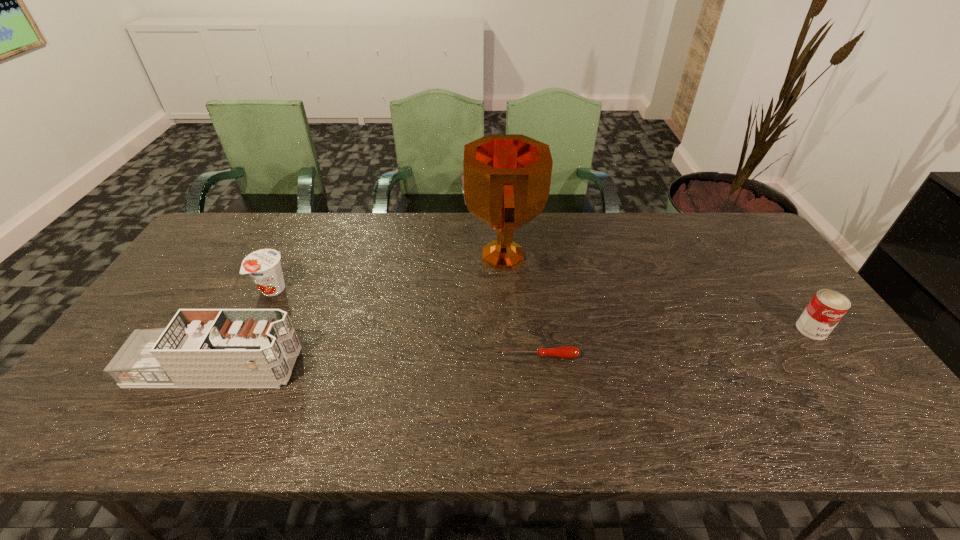
Find the location of a particular element. This screenshot has height=540, width=960. the tallest object is located at coordinates (506, 181).

At what (x,y) coordinates should I click in order to perform the action: click on the second tallest object. Please return your answer as a coordinate pair (x, y). Looking at the image, I should click on (211, 348).

You are a GUI agent. You are given a task and a screenshot of the screen. Output one action in this format:
    pyautogui.click(x=<x>, y=<y>)
    Task: Click on the third nearest object
    
    Given the screenshot: What is the action you would take?
    pyautogui.click(x=827, y=307)

Image resolution: width=960 pixels, height=540 pixels. Identify the location of the rightmost object. pyautogui.click(x=827, y=307).

Where is `yogurt`? Image resolution: width=960 pixels, height=540 pixels. yogurt is located at coordinates (264, 266).

In order to click on screwdriver in this screenshot , I will do `click(566, 352)`.

Identify the location of free space located on the side of the tallest object with the star emblem. (435, 255).

Identify the location of free region located on the side of the tallest object with the star emblem. The width and height of the screenshot is (960, 540). (342, 255).

Identify the location of vacant area situated on the side of the tallest object with the star emblem. (379, 255).

Where is `free space located 0.080m at the entrance of the dollhouse`? This screenshot has height=540, width=960. free space located 0.080m at the entrance of the dollhouse is located at coordinates (328, 368).